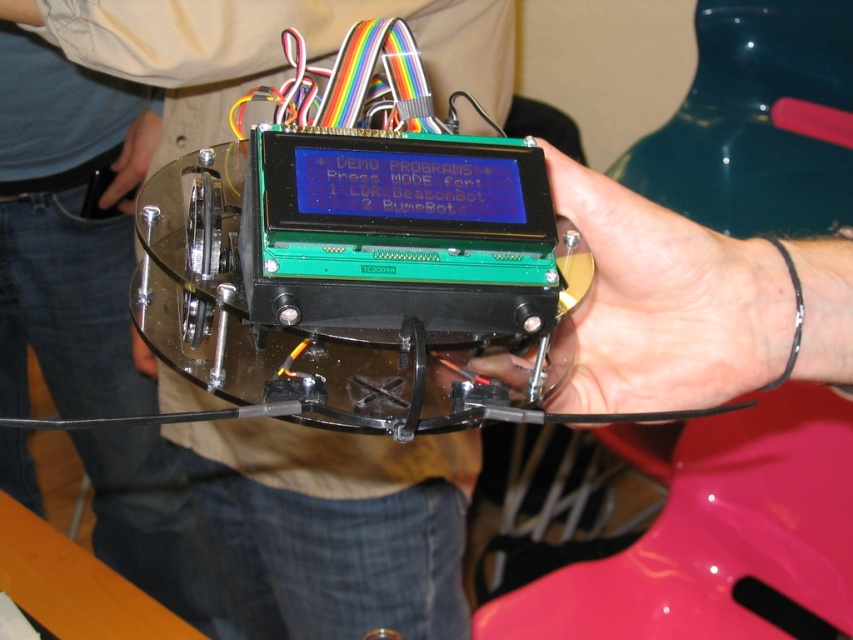
From the picture: Which of these two, matte black laptop at center or green matte lcd screen at center, stands taller?

Standing taller between the two is matte black laptop at center.

Does matte black laptop at center have a greater height compared to green matte lcd screen at center?

Indeed, matte black laptop at center has a greater height compared to green matte lcd screen at center.

Locate an element on the screen. The image size is (853, 640). matte black laptop at center is located at coordinates (287, 524).